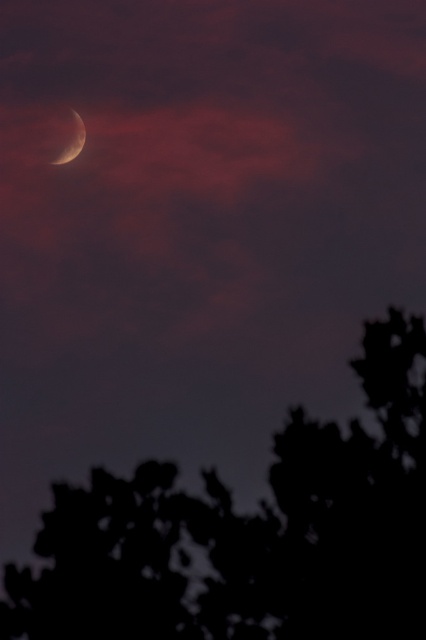
Question: Can you confirm if silhouette leafy tree at upper left is positioned to the left of satin silver crescent at upper left?

Choices:
 (A) no
 (B) yes

Answer: (A)

Question: Which object is closer to the camera taking this photo?

Choices:
 (A) silhouette leafy tree at upper left
 (B) satin silver crescent at upper left

Answer: (A)

Question: In this image, where is silhouette leafy tree at upper left located relative to satin silver crescent at upper left?

Choices:
 (A) below
 (B) above

Answer: (A)

Question: Is silhouette leafy tree at upper left thinner than satin silver crescent at upper left?

Choices:
 (A) yes
 (B) no

Answer: (A)